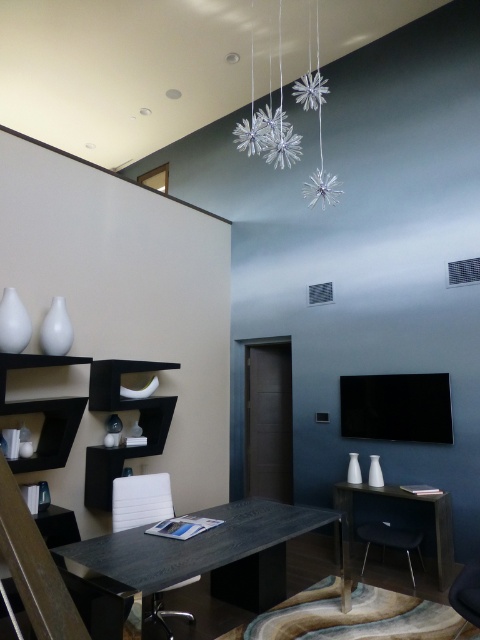
Question: Which point is farther to the camera?

Choices:
 (A) silver metallic snowflake at upper center
 (B) black wood table at center
 (C) white leather armchair at center
 (D) dark wood table at center

Answer: (A)

Question: Can you confirm if black wood table at center is smaller than dark wood table at center?

Choices:
 (A) yes
 (B) no

Answer: (A)

Question: From the image, what is the correct spatial relationship of silver metallic snowflake at upper center in relation to dark wood table at center?

Choices:
 (A) below
 (B) above

Answer: (B)

Question: Which point is closer to the camera taking this photo?

Choices:
 (A) (288, 156)
 (B) (445, 580)
 (C) (172, 588)

Answer: (C)

Question: From the image, what is the correct spatial relationship of silver metallic snowflake at upper center in relation to white leather armchair at center?

Choices:
 (A) right
 (B) left

Answer: (A)

Question: Based on their relative distances, which object is farther from the silver metallic snowflake at upper center?

Choices:
 (A) dark wood table at center
 (B) black wood table at center

Answer: (B)